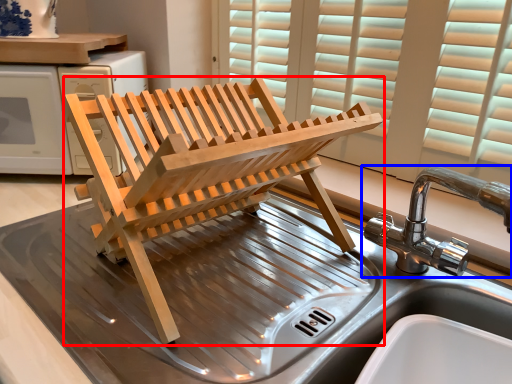
Question: Which point is further to the camera, furniture (highlighted by a red box) or tap (highlighted by a blue box)?

Choices:
 (A) furniture
 (B) tap

Answer: (B)